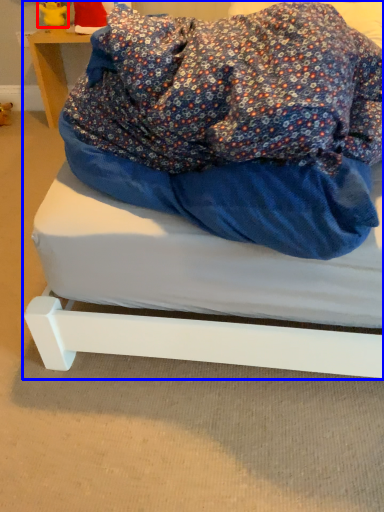
Question: Which object is further to the camera taking this photo, figurine (highlighted by a red box) or bed (highlighted by a blue box)?

Choices:
 (A) figurine
 (B) bed

Answer: (A)